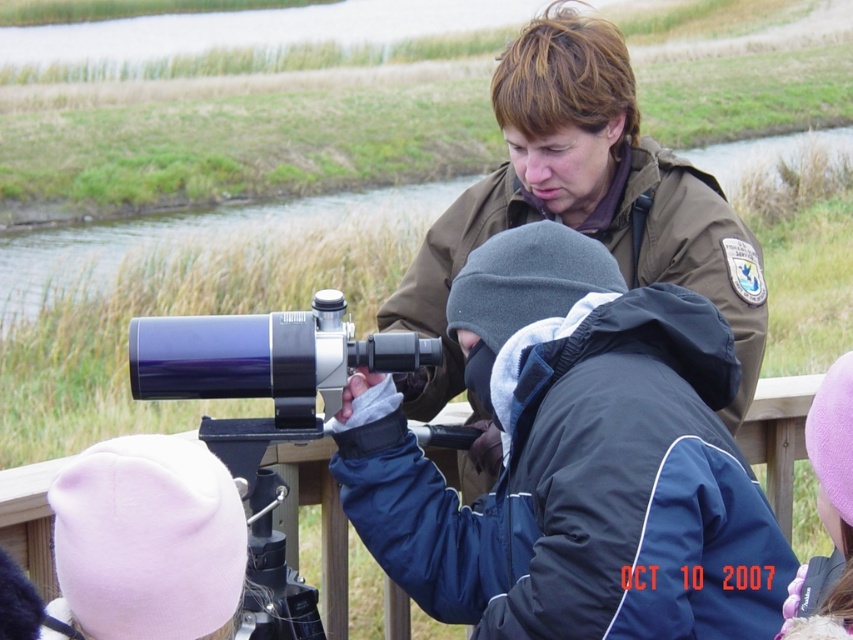
Measure the distance between point (718, 636) and camera.

A distance of 3.09 meters exists between point (718, 636) and camera.

Is dark blue fabric jacket at center taller than matte black telescope at center?

Correct, dark blue fabric jacket at center is much taller as matte black telescope at center.

Who is more forward, (642,595) or (206,323)?

Point (642,595) is in front.

Find the location of a particular element. dark blue fabric jacket at center is located at coordinates (576, 461).

What do you see at coordinates (264, 417) in the screenshot? I see `matte black telescope at center` at bounding box center [264, 417].

Can you confirm if matte black telescope at center is positioned to the right of purple fleece hat at lower right?

In fact, matte black telescope at center is to the left of purple fleece hat at lower right.

Is point (300, 314) less distant than point (817, 584)?

No, (300, 314) is further to viewer.

Locate an element on the screen. This screenshot has width=853, height=640. matte black telescope at center is located at coordinates (264, 417).

Between dark blue fabric jacket at center and purple fleece hat at lower right, which one has less height?

purple fleece hat at lower right is shorter.

Who is positioned more to the left, dark blue fabric jacket at center or purple fleece hat at lower right?

dark blue fabric jacket at center is more to the left.

This screenshot has height=640, width=853. In order to click on dark blue fabric jacket at center in this screenshot , I will do `click(576, 461)`.